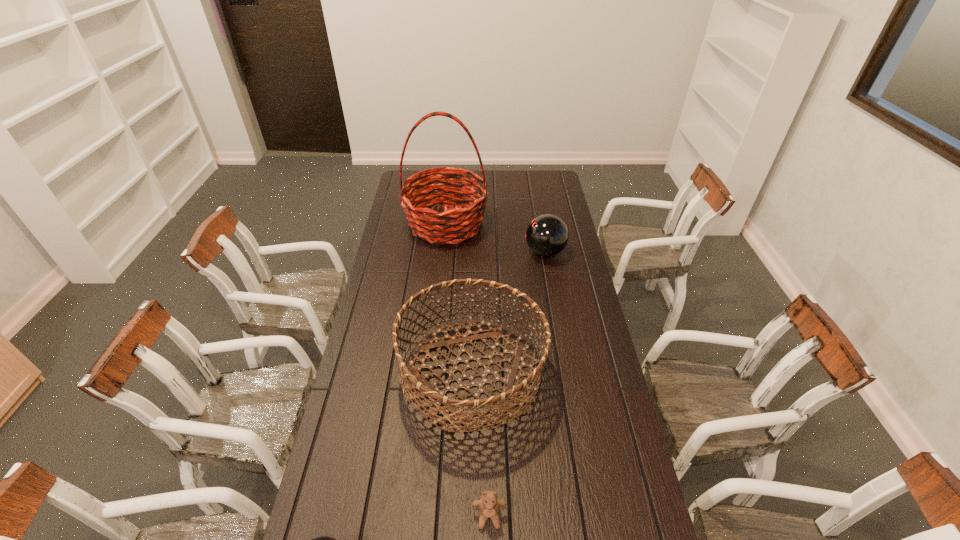
The width and height of the screenshot is (960, 540). What are the coordinates of `the taller basket` in the screenshot? It's located at (458, 222).

You are a GUI agent. You are given a task and a screenshot of the screen. Output one action in this format:
    pyautogui.click(x=<x>, y=<y>)
    Task: Click on the farther basket
    The width and height of the screenshot is (960, 540).
    Given the screenshot: What is the action you would take?
    pyautogui.click(x=458, y=222)

At what (x,y) coordinates should I click in order to perform the action: click on the nearer basket. Please return your answer as a coordinate pair (x, y). Looking at the image, I should click on (426, 389).

Image resolution: width=960 pixels, height=540 pixels. In order to click on the third nearest object in this screenshot , I will do `click(426, 389)`.

You are a GUI agent. You are given a task and a screenshot of the screen. Output one action in this format:
    pyautogui.click(x=<x>, y=<y>)
    Task: Click on the third tallest object
    The width and height of the screenshot is (960, 540).
    Given the screenshot: What is the action you would take?
    pyautogui.click(x=547, y=235)

You are a GUI agent. You are given a task and a screenshot of the screen. Output one action in this format:
    pyautogui.click(x=<x>, y=<y>)
    Task: Click on the right bowling ball
    Image resolution: width=960 pixels, height=540 pixels.
    Given the screenshot: What is the action you would take?
    pyautogui.click(x=547, y=235)

In order to click on teddy bear in this screenshot , I will do `click(489, 505)`.

This screenshot has width=960, height=540. I want to click on the fourth farthest object, so click(489, 505).

Identify the location of free location located on the front of the taller basket. (438, 306).

Where is `vacant region located 0.190m on the front of the nearer basket`? vacant region located 0.190m on the front of the nearer basket is located at coordinates (470, 509).